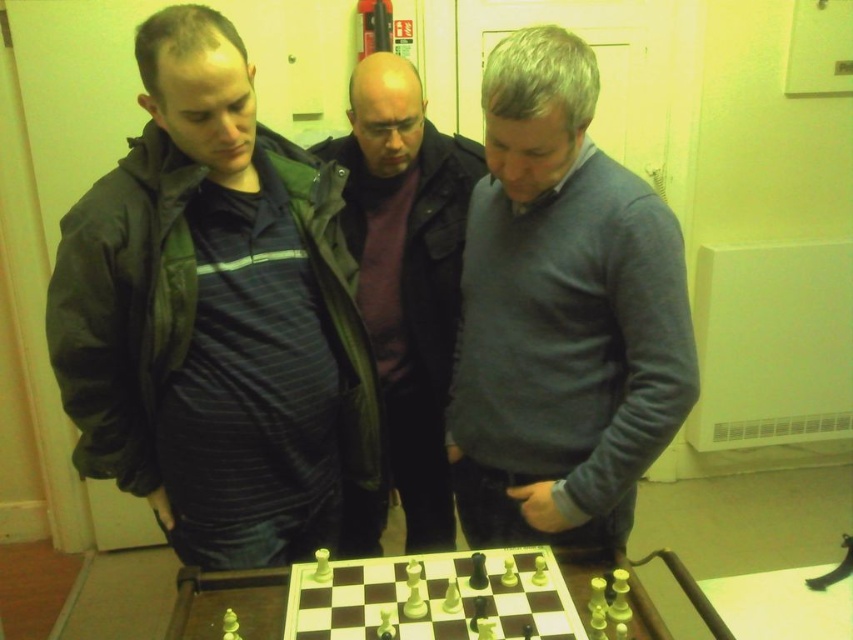
Between dark green jacket at left and dark gray jacket at center, which one has more height?

dark gray jacket at center

Between dark green jacket at left and dark gray jacket at center, which one is positioned lower?

Positioned lower is dark gray jacket at center.

Is point (158, 262) positioned in front of point (430, 532)?

Yes, point (158, 262) is in front of point (430, 532).

The image size is (853, 640). What are the coordinates of `dark green jacket at left` in the screenshot? It's located at (213, 316).

In the scene shown: Does dark green jacket at left have a greater height compared to gray sweater at center?

Correct, dark green jacket at left is much taller as gray sweater at center.

Can you confirm if dark green jacket at left is thinner than gray sweater at center?

In fact, dark green jacket at left might be wider than gray sweater at center.

Is point (270, 317) closer to camera compared to point (486, 72)?

No, it is not.

Where is `dark green jacket at left`? This screenshot has height=640, width=853. dark green jacket at left is located at coordinates (213, 316).

Who is positioned more to the left, dark green jacket at left or wooden chessboard at center?

Positioned to the left is dark green jacket at left.

Does dark green jacket at left come behind wooden chessboard at center?

Yes, it is.

Which is in front, point (178, 246) or point (509, 573)?

Point (178, 246)

This screenshot has height=640, width=853. What are the coordinates of `dark green jacket at left` in the screenshot? It's located at (213, 316).